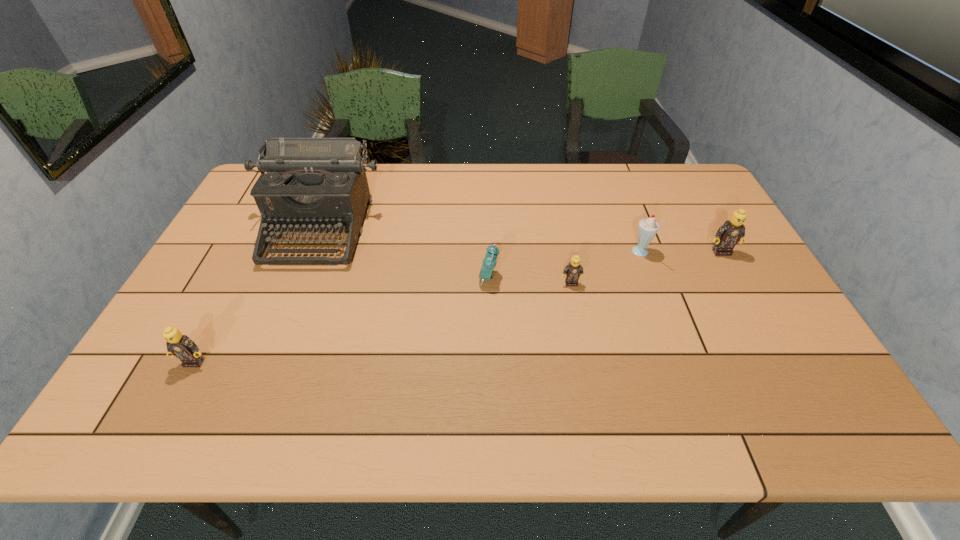
Identify the location of free space between the rightmost object and the nearest object. (458, 307).

Find the location of `free space between the third object from left to right and the leftmost Lego`. free space between the third object from left to right and the leftmost Lego is located at coordinates (342, 320).

Find the location of a particular element. The height and width of the screenshot is (540, 960). free space between the milkshake and the fourth object from right to left is located at coordinates (564, 266).

The height and width of the screenshot is (540, 960). Identify the location of free space between the typewriter and the farthest Lego. (520, 240).

Image resolution: width=960 pixels, height=540 pixels. I want to click on vacant area that lies between the milkshake and the nearest Lego, so coord(418,308).

This screenshot has height=540, width=960. Identify the location of empty space between the fourth object from right to left and the rightmost object. (605, 265).

Identify the location of empty location between the second object from right to left and the third object from left to right. The height and width of the screenshot is (540, 960). (564, 266).

The width and height of the screenshot is (960, 540). Find the location of `vacant area between the alarm clock and the fifth object from left to right`. vacant area between the alarm clock and the fifth object from left to right is located at coordinates (564, 266).

Where is `free space between the fifth object from left to right and the third object from right to left`? The width and height of the screenshot is (960, 540). free space between the fifth object from left to right and the third object from right to left is located at coordinates (606, 268).

The image size is (960, 540). Find the location of `the fifth closest object to the second shortest Lego`. the fifth closest object to the second shortest Lego is located at coordinates (732, 231).